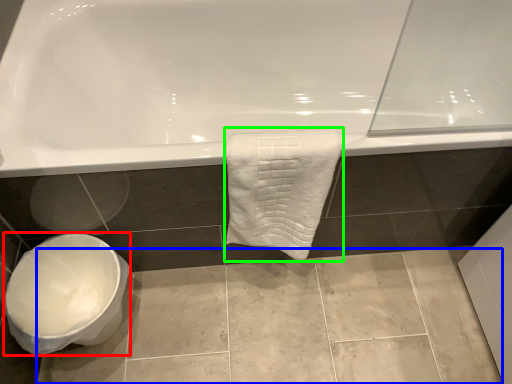
Question: Which object is the farthest from toilet bowl (highlighted by a red box)? Choose among these: ceramic tile (highlighted by a blue box) or towel (highlighted by a green box).

Choices:
 (A) ceramic tile
 (B) towel

Answer: (B)